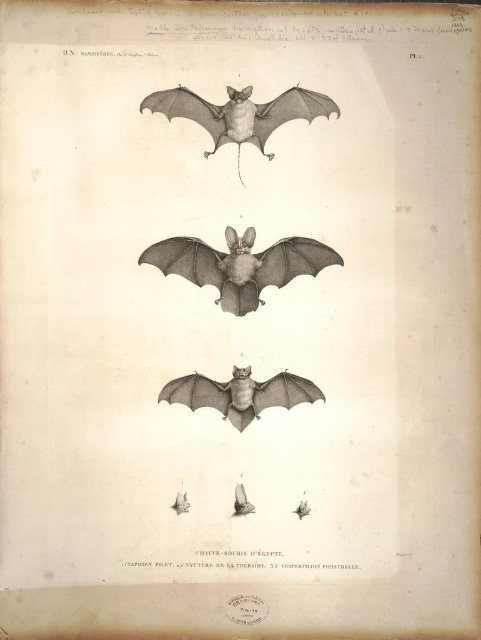
In the scientific illustration, there are two central elements labeled as the matte black wing at center and the gray ink bat at center. Considering their sizes, which one would cast a larger shadow on the page?

The matte black wing at center is much taller than the gray ink bat at center, so it would cast a larger shadow on the page.

You are an artist examining this illustration and notice two key elements at the center. The matte black wing at center and the gray ink bat at center. Which of these two elements is positioned to the right in the illustration?

The matte black wing at center is positioned to the right of the gray ink bat at center in the illustration.